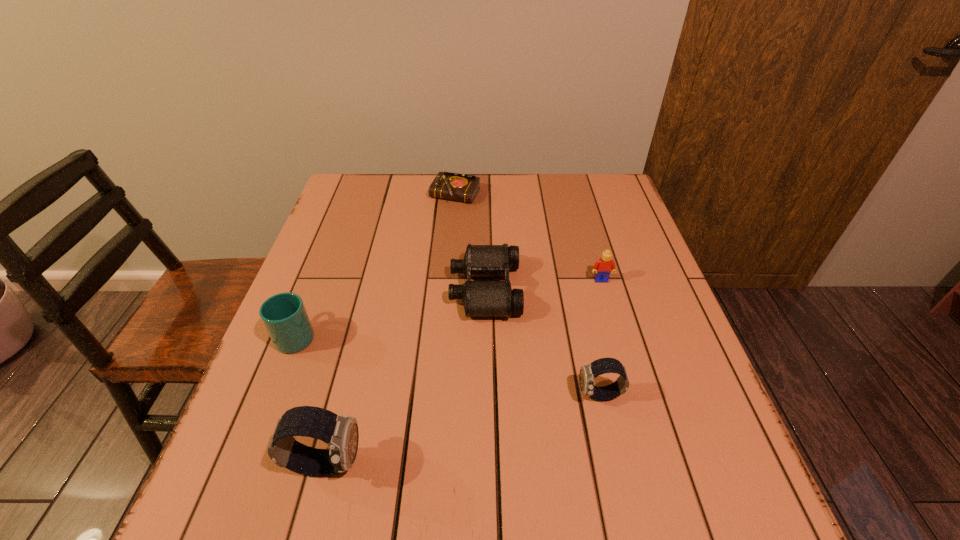
This screenshot has height=540, width=960. I want to click on vacant space located 0.150m on the face of the right watch, so click(501, 396).

Locate an element on the screen. This screenshot has width=960, height=540. free space located on the face of the right watch is located at coordinates (377, 396).

Locate an element on the screen. free space located 0.070m on the face of the right watch is located at coordinates (542, 396).

Where is `free space located on the left of the diary`? free space located on the left of the diary is located at coordinates (340, 195).

Identify the location of vacant space located 0.310m through the eyepieces of the binoculars. (324, 289).

You are a GUI agent. You are given a task and a screenshot of the screen. Output one action in this format:
    pyautogui.click(x=<x>, y=<y>)
    Task: Click on the vacant region located 0.160m through the eyepieces of the binoculars
    The image size is (960, 540).
    Given the screenshot: What is the action you would take?
    pyautogui.click(x=385, y=289)

Identify the location of free region located through the eyepieces of the binoculars. (401, 289).

You are a GUI agent. You are given a task and a screenshot of the screen. Output one action in this format:
    pyautogui.click(x=<x>, y=<y>)
    Task: Click on the vacant space situated on the handle side of the cup
    This screenshot has height=540, width=960.
    Given the screenshot: What is the action you would take?
    pyautogui.click(x=325, y=261)

Where is `free space located 0.050m on the handle side of the cup`? This screenshot has width=960, height=540. free space located 0.050m on the handle side of the cup is located at coordinates (310, 300).

Find the location of a particular element. free region located on the handle side of the cup is located at coordinates (341, 221).